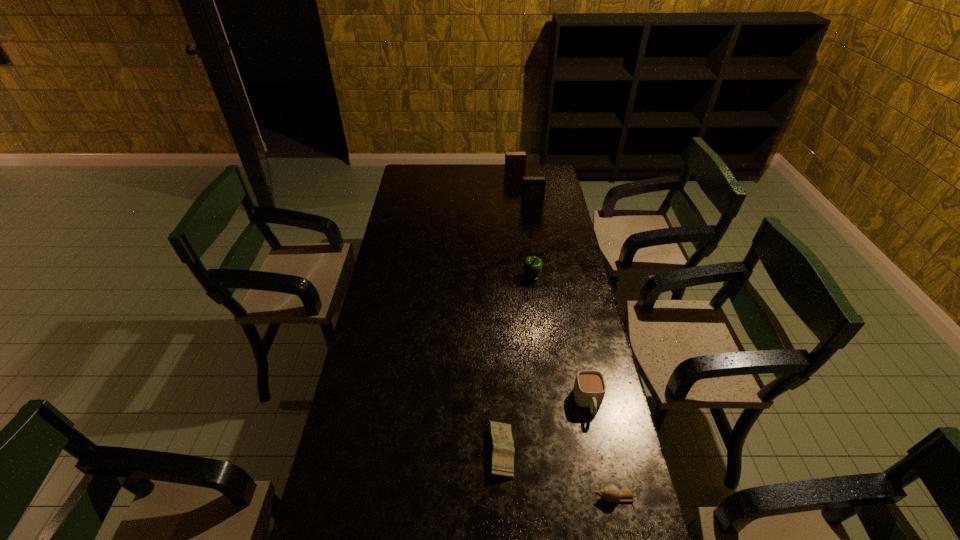
This screenshot has height=540, width=960. In order to click on blank space located on the spine side of the farthest diary in this screenshot , I will do `click(451, 176)`.

Where is `blank space located on the spine side of the farthest diary`? blank space located on the spine side of the farthest diary is located at coordinates (490, 176).

At what (x,y) coordinates should I click in order to perform the action: click on vacant position located on the back of the bell pepper. Please return your answer as a coordinate pair (x, y). This screenshot has height=540, width=960. Looking at the image, I should click on (528, 246).

At what (x,y) coordinates should I click in order to perform the action: click on blank area located 0.190m on the side with the handle of the cup. Please return your answer as a coordinate pair (x, y). The height and width of the screenshot is (540, 960). Looking at the image, I should click on (605, 485).

Locate an element on the screen. The width and height of the screenshot is (960, 540). vacant area situated on the left of the shortest diary is located at coordinates click(x=385, y=451).

Identify the location of free space located 0.130m on the shell of the nearest object. (549, 496).

In order to click on free space located on the shell of the nearest object in this screenshot , I will do `click(471, 496)`.

Identify the location of vacant space located 0.240m on the shell of the nearest object. This screenshot has width=960, height=540. (508, 496).

The width and height of the screenshot is (960, 540). I want to click on object at the far edge, so click(515, 161).

Find the location of a particular element. The height and width of the screenshot is (540, 960). diary that is at the right edge is located at coordinates (533, 187).